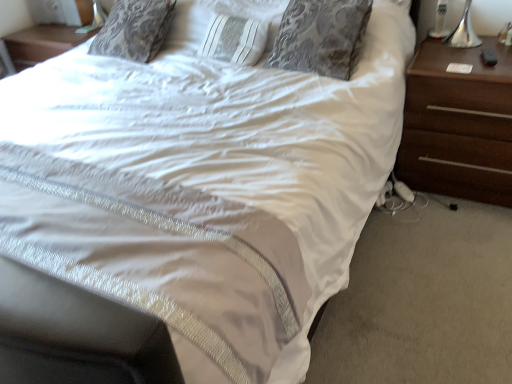
The image size is (512, 384). Describe the element at coordinates (321, 36) in the screenshot. I see `silver damask pillow at upper center` at that location.

The height and width of the screenshot is (384, 512). In order to click on silver damask pillow at upper center in this screenshot , I will do `click(321, 36)`.

The image size is (512, 384). What do you see at coordinates (458, 124) in the screenshot? I see `brown wood nightstand at right` at bounding box center [458, 124].

Identify the location of brown wood nightstand at right. (458, 124).

You are a GUI agent. You are given a task and a screenshot of the screen. Output one action in this format:
    pyautogui.click(x=<x>, y=<y>)
    Task: Click on the silver damask pillow at upper center
    This screenshot has width=512, height=384.
    Given the screenshot: What is the action you would take?
    pyautogui.click(x=321, y=36)

Considering the positions of objects brown wood nightstand at right and silver damask pillow at upper center in the image provided, who is more to the left, brown wood nightstand at right or silver damask pillow at upper center?

Positioned to the left is silver damask pillow at upper center.

Which object is more forward, brown wood nightstand at right or silver damask pillow at upper center?

brown wood nightstand at right is in front.

Considering the points (478, 122) and (288, 49), which point is behind, point (478, 122) or point (288, 49)?

The point (288, 49) is farther from the camera.

From the image's perspective, is brown wood nightstand at right located above or below silver damask pillow at upper center?

From the image's perspective, brown wood nightstand at right appears below silver damask pillow at upper center.

From a real-world perspective, which is physically above, brown wood nightstand at right or silver damask pillow at upper center?

silver damask pillow at upper center.

Based on the photo, which of these two, brown wood nightstand at right or silver damask pillow at upper center, is thinner?

silver damask pillow at upper center.

Is brown wood nightstand at right taller than silver damask pillow at upper center?

Correct, brown wood nightstand at right is much taller as silver damask pillow at upper center.

Which of these two, brown wood nightstand at right or silver damask pillow at upper center, is bigger?

brown wood nightstand at right is bigger.

In the scene shown: Would you say brown wood nightstand at right is outside silver damask pillow at upper center?

Absolutely, brown wood nightstand at right is external to silver damask pillow at upper center.

Is brown wood nightstand at right directly adjacent to silver damask pillow at upper center?

brown wood nightstand at right and silver damask pillow at upper center are clearly separated.

Is brown wood nightstand at right turned away from silver damask pillow at upper center?

No.

How much distance is there between brown wood nightstand at right and silver damask pillow at upper center?

brown wood nightstand at right is 19.38 inches away from silver damask pillow at upper center.

I want to click on pillow on the left of brown wood nightstand at right, so click(321, 36).

Between silver damask pillow at upper center and brown wood nightstand at right, which one appears on the left side from the viewer's perspective?

silver damask pillow at upper center is more to the left.

Considering the relative positions of silver damask pillow at upper center and brown wood nightstand at right in the image provided, is silver damask pillow at upper center behind brown wood nightstand at right?

Yes, it is behind brown wood nightstand at right.

Is point (284, 50) positioned in front of point (478, 174)?

Yes.

From the image's perspective, is silver damask pillow at upper center above or below brown wood nightstand at right?

From the image's perspective, silver damask pillow at upper center appears above brown wood nightstand at right.

From a real-world perspective, relative to brown wood nightstand at right, is silver damask pillow at upper center vertically above or below?

In terms of real-world spatial position, silver damask pillow at upper center is above brown wood nightstand at right.

Looking at their sizes, would you say silver damask pillow at upper center is wider or thinner than brown wood nightstand at right?

Considering their sizes, silver damask pillow at upper center looks slimmer than brown wood nightstand at right.

Who is taller, silver damask pillow at upper center or brown wood nightstand at right?

brown wood nightstand at right is taller.

Considering the sizes of objects silver damask pillow at upper center and brown wood nightstand at right in the image provided, who is bigger, silver damask pillow at upper center or brown wood nightstand at right?

Bigger between the two is brown wood nightstand at right.

Is brown wood nightstand at right completely or partially inside silver damask pillow at upper center?

No, brown wood nightstand at right is located outside of silver damask pillow at upper center.

Is silver damask pillow at upper center not close to brown wood nightstand at right?

No, silver damask pillow at upper center is not far from brown wood nightstand at right.

Consider the image. Is silver damask pillow at upper center facing towards brown wood nightstand at right?

No, silver damask pillow at upper center is not turned towards brown wood nightstand at right.

How different are the orientations of silver damask pillow at upper center and brown wood nightstand at right in degrees?

There is a 2.95-degree angle between the facing directions of silver damask pillow at upper center and brown wood nightstand at right.

There is a brown wood nightstand at right. In order to click on pillow above it (from a real-world perspective) in this screenshot , I will do `click(321, 36)`.

This screenshot has width=512, height=384. Identify the location of pillow behind the brown wood nightstand at right. (321, 36).

Identify the location of pillow above the brown wood nightstand at right (from the image's perspective). The height and width of the screenshot is (384, 512). pyautogui.click(x=321, y=36).